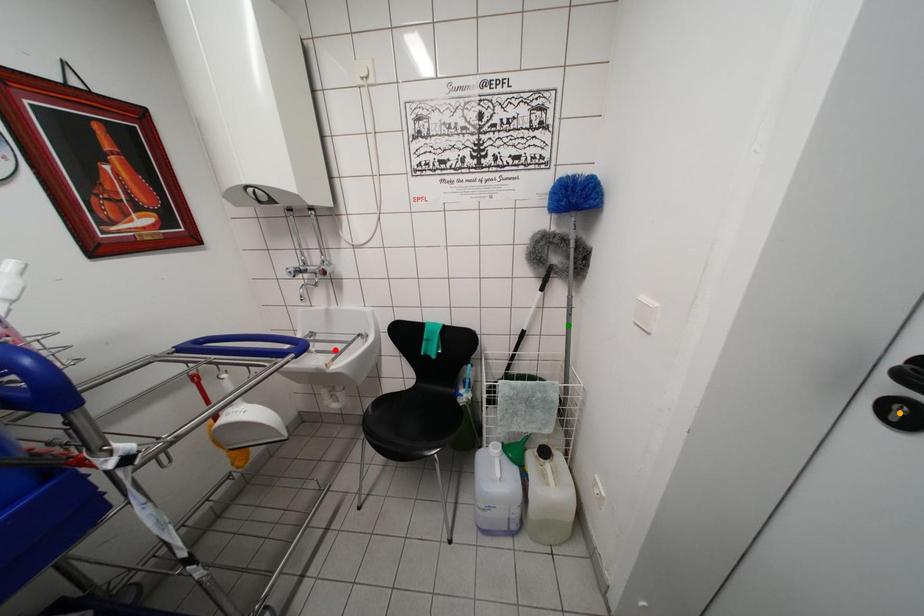
Order these from nearest to farthest:
green point | red point | orange point

orange point, green point, red point